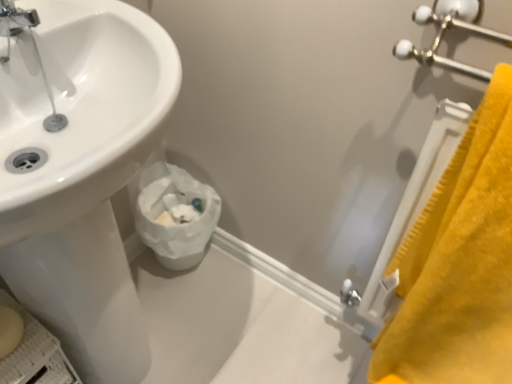
Question: From a real-world perspective, does yellow plush bath towel at right sit lower than white paper at lower center?

Choices:
 (A) yes
 (B) no

Answer: (B)

Question: Considering the relative positions of yellow plush bath towel at right and white paper at lower center in the image provided, is yellow plush bath towel at right to the right of white paper at lower center from the viewer's perspective?

Choices:
 (A) no
 (B) yes

Answer: (B)

Question: Is yellow plush bath towel at right oriented towards white paper at lower center?

Choices:
 (A) yes
 (B) no

Answer: (B)

Question: Is yellow plush bath towel at right thinner than white paper at lower center?

Choices:
 (A) yes
 (B) no

Answer: (A)

Question: Considering the relative sizes of yellow plush bath towel at right and white paper at lower center in the image provided, is yellow plush bath towel at right bigger than white paper at lower center?

Choices:
 (A) no
 (B) yes

Answer: (B)

Question: Is yellow plush bath towel at right positioned behind white paper at lower center?

Choices:
 (A) yes
 (B) no

Answer: (B)

Question: Is white paper at lower center positioned before yellow plush bath towel at right?

Choices:
 (A) yes
 (B) no

Answer: (B)

Question: Considering the relative sizes of white paper at lower center and yellow plush bath towel at right in the image provided, is white paper at lower center taller than yellow plush bath towel at right?

Choices:
 (A) no
 (B) yes

Answer: (A)

Question: Is white paper at lower center smaller than yellow plush bath towel at right?

Choices:
 (A) no
 (B) yes

Answer: (B)

Question: From the image's perspective, is white paper at lower center over yellow plush bath towel at right?

Choices:
 (A) no
 (B) yes

Answer: (A)

Question: Does white paper at lower center appear on the left side of yellow plush bath towel at right?

Choices:
 (A) no
 (B) yes

Answer: (B)

Question: Is white paper at lower center shorter than yellow plush bath towel at right?

Choices:
 (A) yes
 (B) no

Answer: (A)

Question: Is yellow plush bath towel at right positioned before chrome metallic faucet at upper left?

Choices:
 (A) no
 (B) yes

Answer: (B)